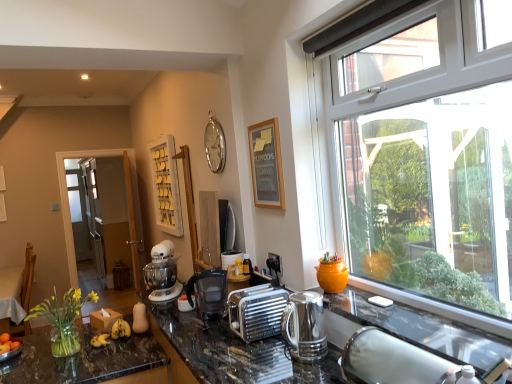
This screenshot has height=384, width=512. I want to click on free spot in front of polished stainless steel kettle at lower right, which is the 1th coffee machine from front to back, so click(303, 369).